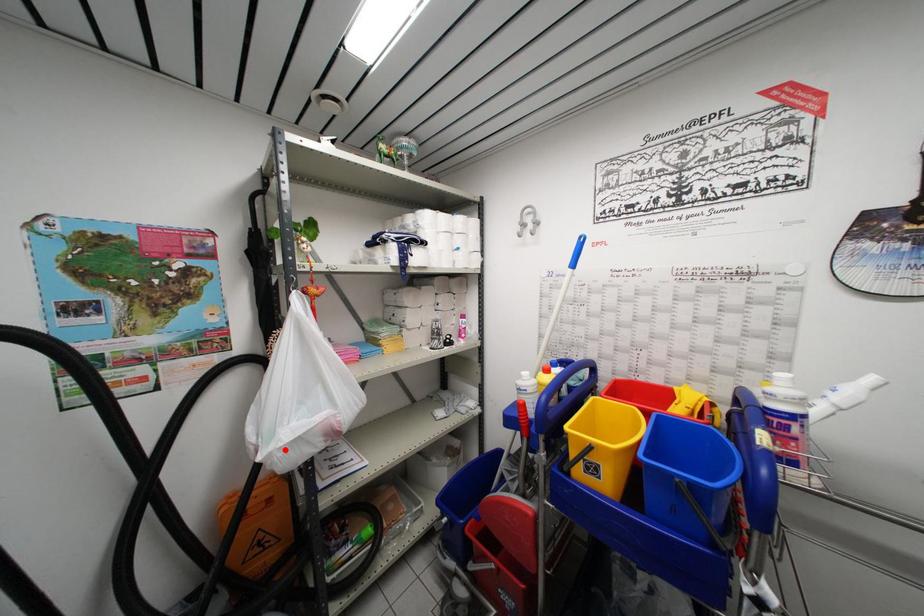
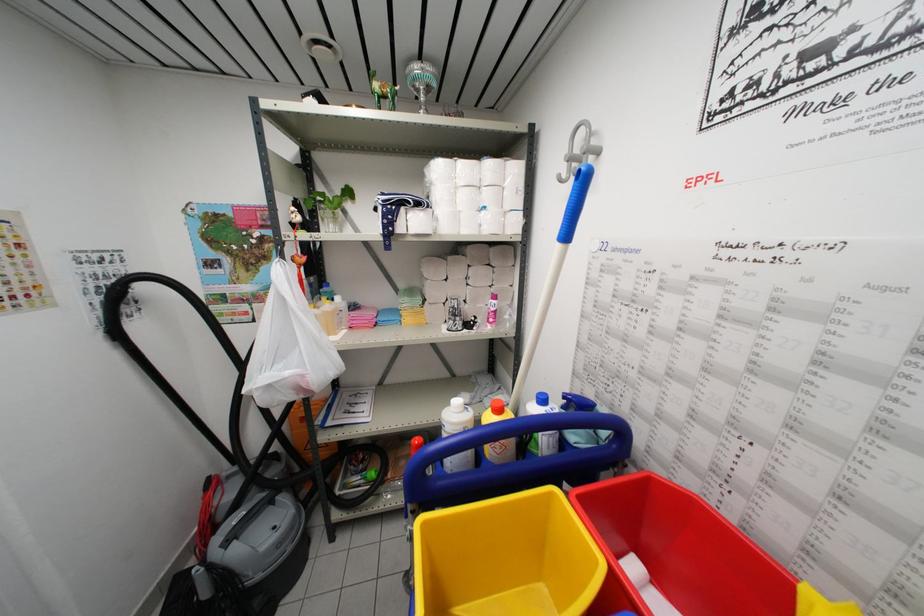
Locate, in the second image, the point that corresponds to the highlighted location in the first image.

(258, 392)